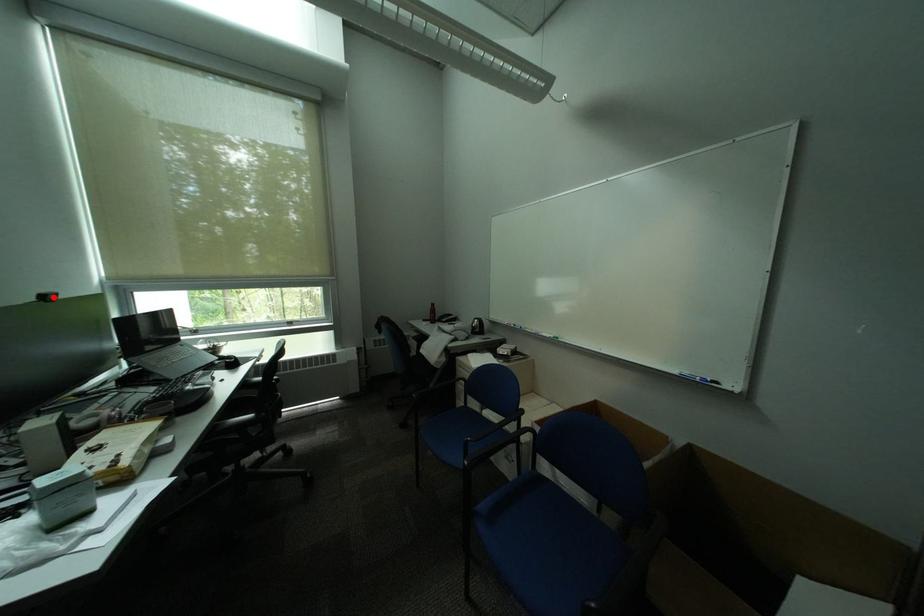
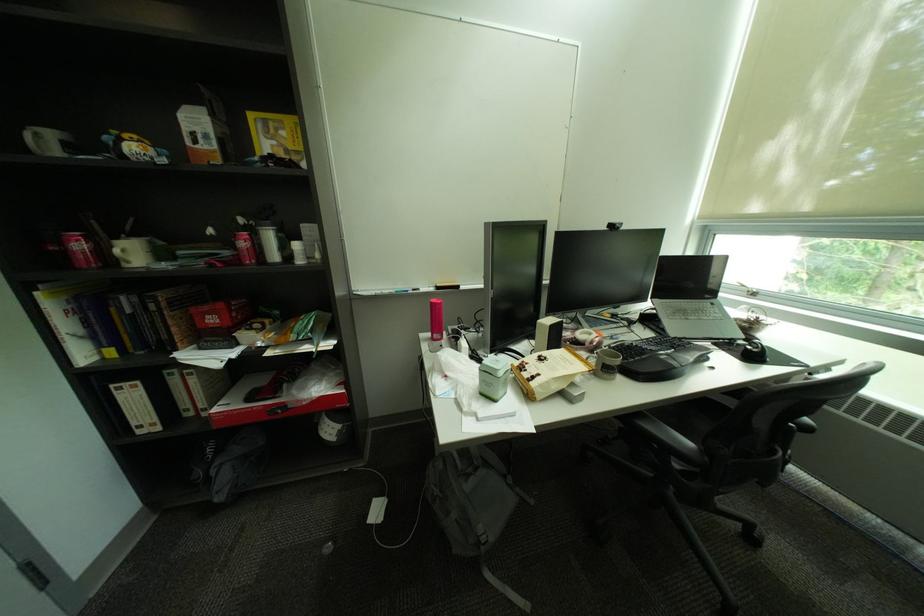
In the second image, find the point that corresponds to the highlighted location in the first image.

(621, 227)